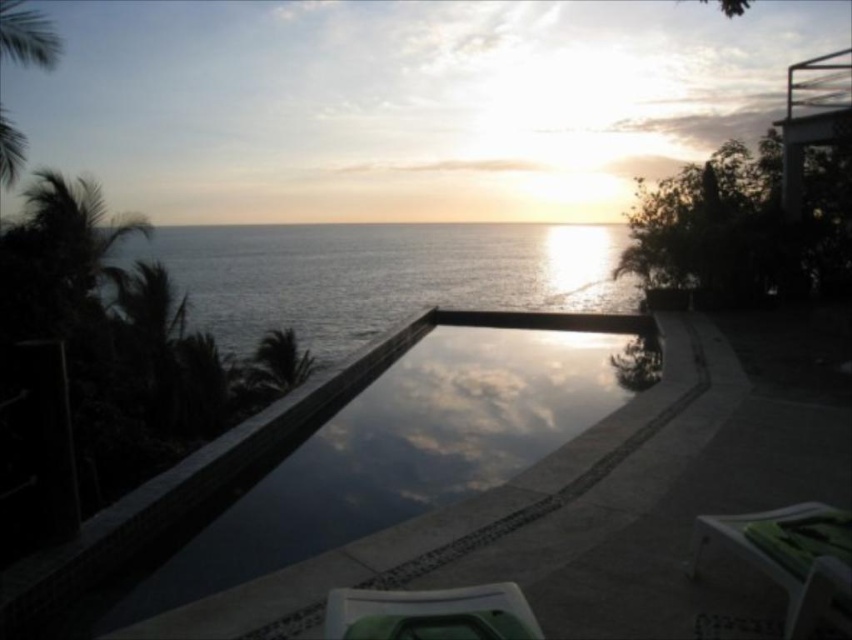
You are planning to place a small table between the green plastic chair at lower center and the infinity pool. The table requires 2 meters of space. Is there enough space between them to place the table?

The distance between the green plastic chair at lower center and the infinity pool is 2.20 meters. Since the table requires 2 meters of space, there is enough space to place the table between them.

You are standing at the edge of the infinity pool and want to take a photo of both the point at coordinates point (475, 486) and point (438, 600). Which point will appear closer to the camera in your photo?

Point (438, 600) will appear closer to the camera in the photo because it is physically closer to the camera than point (475, 486), which is further away.

You are standing at the edge of the smooth concrete pool at center and want to reach the green plastic chair at lower center. In which direction should you walk to get there?

You should walk to the left because the smooth concrete pool at center is to the right of the green plastic chair at lower center, so moving left will take you towards the chair.